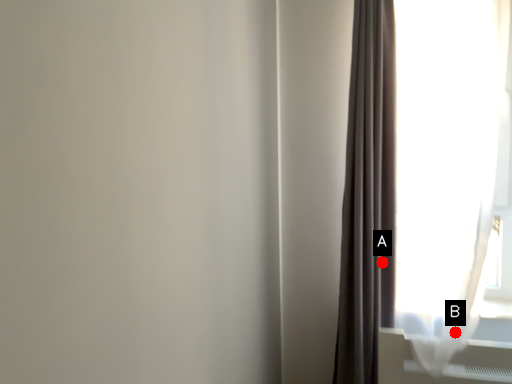
Question: Two points are circled on the image, labeled by A and B beside each circle. Among these points, which one is farthest from the camera?

Choices:
 (A) A is further
 (B) B is further

Answer: (A)